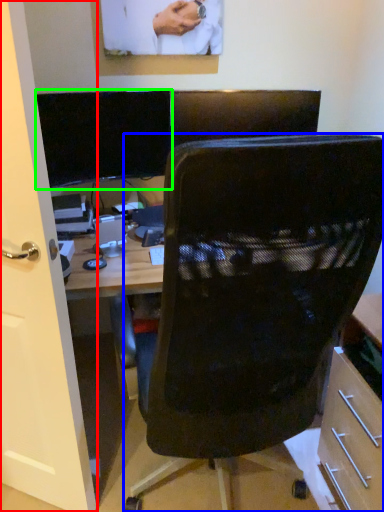
Question: Which object is positioned farthest from glass door (highlighted by a red box)? Select from chair (highlighted by a blue box) and computer monitor (highlighted by a green box).

Choices:
 (A) chair
 (B) computer monitor

Answer: (B)